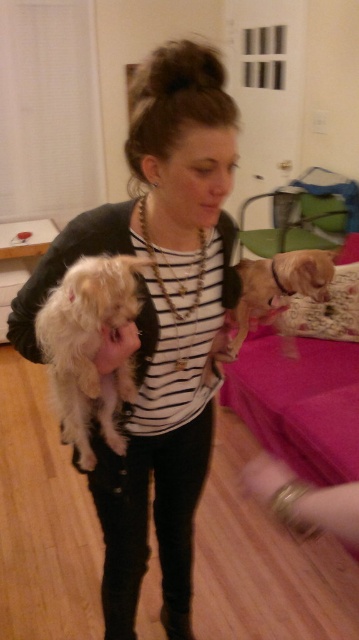
Question: Can you confirm if gold metallic bracelet at lower right is positioned to the left of light brown fur at center?

Choices:
 (A) yes
 (B) no

Answer: (A)

Question: Can you confirm if fluffy white dog at center is wider than light brown fur at center?

Choices:
 (A) yes
 (B) no

Answer: (B)

Question: Which point is closer to the camera taking this photo?

Choices:
 (A) (325, 525)
 (B) (187, 113)

Answer: (A)

Question: Which point is farther to the camera?

Choices:
 (A) white striped shirt at center
 (B) gold metallic bracelet at lower right

Answer: (A)

Question: Considering the real-world distances, which object is closest to the white striped shirt at center?

Choices:
 (A) gold metallic bracelet at lower right
 (B) fluffy white dog at center

Answer: (B)

Question: In this image, where is gold metallic bracelet at lower right located relative to light brown fur at center?

Choices:
 (A) above
 (B) below

Answer: (B)